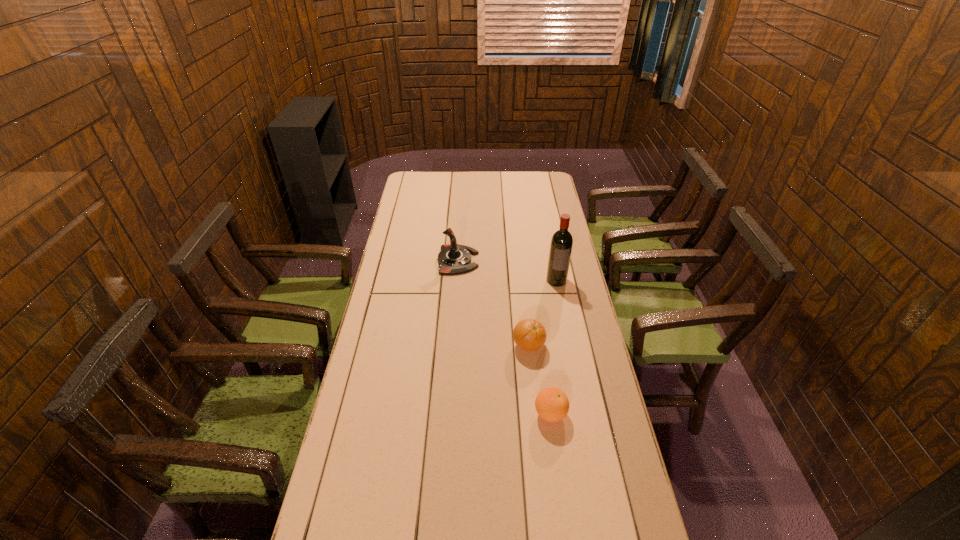
You are a GUI agent. You are given a task and a screenshot of the screen. Output one action in this format:
    pyautogui.click(x=<x>, y=<y>)
    Task: Click on the tallest object
    
    Given the screenshot: What is the action you would take?
    (x=561, y=245)

This screenshot has height=540, width=960. I want to click on the rightmost object, so click(561, 245).

The width and height of the screenshot is (960, 540). I want to click on the third shortest object, so click(x=453, y=259).

You are a GUI agent. You are given a task and a screenshot of the screen. Output one action in this format:
    pyautogui.click(x=<x>, y=<y>)
    Task: Click on the joystick
    The image size is (960, 540).
    Given the screenshot: What is the action you would take?
    pyautogui.click(x=453, y=259)

Locate an element on the screen. Image resolution: width=960 pixels, height=540 pixels. the third farthest object is located at coordinates (530, 335).

Identify the location of the nearest object. The width and height of the screenshot is (960, 540). (552, 404).

Where is `free space located 0.250m on the label of the tallest object`? The image size is (960, 540). free space located 0.250m on the label of the tallest object is located at coordinates (567, 335).

Where is `vacant space situated on the handle side of the joystick`? The width and height of the screenshot is (960, 540). vacant space situated on the handle side of the joystick is located at coordinates (495, 260).

Identify the location of vacant space located on the front of the second nearest object. This screenshot has height=540, width=960. pyautogui.click(x=534, y=397).

In order to click on vacant region located 0.190m on the left of the nearer orange in this screenshot , I will do `click(469, 414)`.